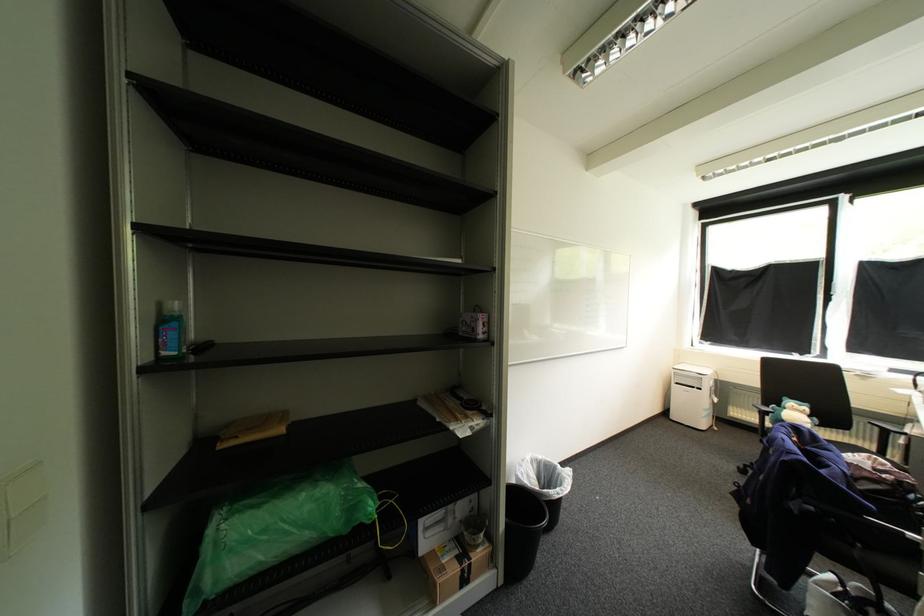
Where is `small purple box`? This screenshot has width=924, height=616. small purple box is located at coordinates (473, 323).